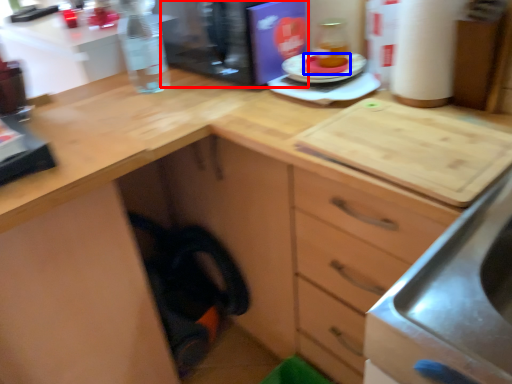
Question: Which of the following is the farthest to the observer, appliance (highlighted by a red box) or food (highlighted by a blue box)?

Choices:
 (A) appliance
 (B) food

Answer: (B)